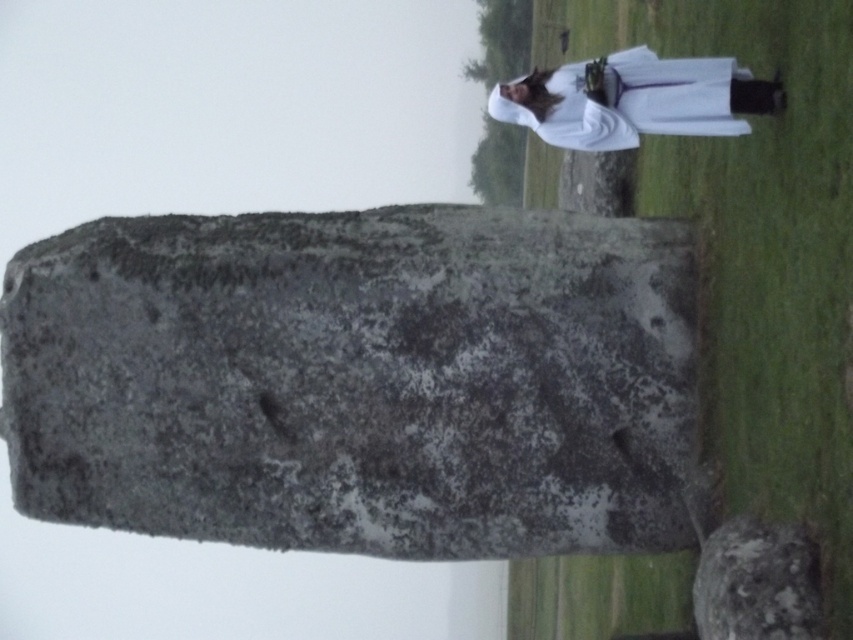
Question: Is gray stone at center bigger than gray rough stone at center?

Choices:
 (A) no
 (B) yes

Answer: (B)

Question: Which object appears farthest from the camera in this image?

Choices:
 (A) white cloth at upper right
 (B) gray rough stone at center
 (C) gray stone at center

Answer: (C)

Question: Can you confirm if gray stone at center is positioned to the left of gray rough stone at center?

Choices:
 (A) no
 (B) yes

Answer: (B)

Question: Is gray stone at center above white cloth at upper right?

Choices:
 (A) yes
 (B) no

Answer: (B)

Question: Estimate the real-world distances between objects in this image. Which object is farther from the white cloth at upper right?

Choices:
 (A) gray rough stone at center
 (B) gray stone at center

Answer: (A)

Question: Which of the following is the farthest from the observer?

Choices:
 (A) (590, 147)
 (B) (482, 493)
 (C) (730, 561)

Answer: (B)